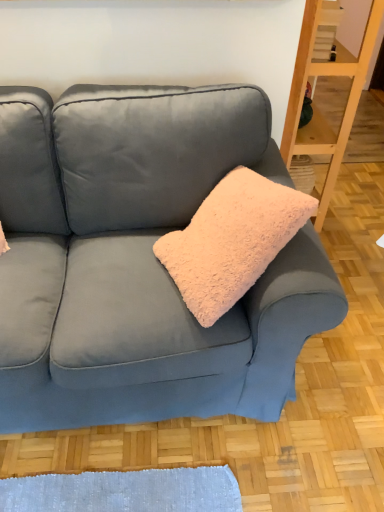
This screenshot has width=384, height=512. What do you see at coordinates (232, 241) in the screenshot?
I see `fuzzy pink pillow at center` at bounding box center [232, 241].

What do you see at coordinates (139, 260) in the screenshot? I see `velvet blue couch at center` at bounding box center [139, 260].

The image size is (384, 512). In order to click on wooden shelf at right in this screenshot , I will do `click(316, 106)`.

Where is `fuzzy pink pillow at center`? fuzzy pink pillow at center is located at coordinates (232, 241).

Is fuzzy pink pillow at center taller or shorter than velvet blue couch at center?

Clearly, fuzzy pink pillow at center is shorter compared to velvet blue couch at center.

Between fuzzy pink pillow at center and velvet blue couch at center, which one appears on the left side from the viewer's perspective?

velvet blue couch at center is more to the left.

Which is farther, (210, 218) or (69, 183)?

The point (69, 183) is farther.

Considering the relative sizes of wooden shelf at right and velvet blue couch at center in the image provided, is wooden shelf at right smaller than velvet blue couch at center?

Yes, wooden shelf at right is smaller than velvet blue couch at center.

Does point (329, 64) come in front of point (245, 366)?

No.

Considering the relative sizes of wooden shelf at right and velvet blue couch at center in the image provided, is wooden shelf at right thinner than velvet blue couch at center?

Indeed, wooden shelf at right has a lesser width compared to velvet blue couch at center.

From the image's perspective, which is above, wooden shelf at right or fuzzy pink pillow at center?

From the image's view, wooden shelf at right is above.

Consider the image. Considering the sizes of wooden shelf at right and fuzzy pink pillow at center in the image, is wooden shelf at right taller or shorter than fuzzy pink pillow at center?

In the image, wooden shelf at right appears to be taller than fuzzy pink pillow at center.

Would you say wooden shelf at right contains fuzzy pink pillow at center?

No, fuzzy pink pillow at center is not a part of wooden shelf at right.

Is wooden shelf at right oriented towards fuzzy pink pillow at center?

No, wooden shelf at right is not turned towards fuzzy pink pillow at center.

What's the angular difference between velvet blue couch at center and fuzzy pink pillow at center's facing directions?

The angle between the facing direction of velvet blue couch at center and the facing direction of fuzzy pink pillow at center is 90 degrees.

Consider the image. From a real-world perspective, is velvet blue couch at center on top of fuzzy pink pillow at center?

Incorrect, from a real-world perspective, velvet blue couch at center is lower than fuzzy pink pillow at center.

Is velvet blue couch at center far away from fuzzy pink pillow at center?

No, velvet blue couch at center is not far away from fuzzy pink pillow at center.

In the scene shown: Would you say velvet blue couch at center is outside fuzzy pink pillow at center?

Yes, velvet blue couch at center is not within fuzzy pink pillow at center.

From the image's perspective, which one is positioned lower, velvet blue couch at center or wooden shelf at right?

velvet blue couch at center, from the image's perspective.

From a real-world perspective, between velvet blue couch at center and wooden shelf at right, who is vertically lower?

velvet blue couch at center.

Who is shorter, velvet blue couch at center or wooden shelf at right?

velvet blue couch at center.

Is velvet blue couch at center oriented towards wooden shelf at right?

No.

Would you say fuzzy pink pillow at center is to the left or to the right of wooden shelf at right in the picture?

In the image, fuzzy pink pillow at center appears on the left side of wooden shelf at right.

Looking at this image, which point is more forward, (202,226) or (377,19)?

The point (202,226) is in front.

Who is bigger, fuzzy pink pillow at center or wooden shelf at right?

With larger size is fuzzy pink pillow at center.

From a real-world perspective, is fuzzy pink pillow at center above or below wooden shelf at right?

fuzzy pink pillow at center is situated higher than wooden shelf at right in the real world.

Locate an element on the screen. studio couch that is under the fuzzy pink pillow at center (from a real-world perspective) is located at coordinates (139, 260).

At what (x,y) coordinates should I click in order to perform the action: click on shelf lying above the velvet blue couch at center (from the image's perspective). Please return your answer as a coordinate pair (x, y). Looking at the image, I should click on (316, 106).

Considering their positions, is velvet blue couch at center positioned closer to wooden shelf at right than fuzzy pink pillow at center?

fuzzy pink pillow at center is closer to wooden shelf at right.

Estimate the real-world distances between objects in this image. Which object is further from velvet blue couch at center, fuzzy pink pillow at center or wooden shelf at right?

wooden shelf at right is further to velvet blue couch at center.

Looking at the image, which one is located further to fuzzy pink pillow at center, velvet blue couch at center or wooden shelf at right?

Based on the image, wooden shelf at right appears to be further to fuzzy pink pillow at center.

Estimate the real-world distances between objects in this image. Which object is closer to velvet blue couch at center, wooden shelf at right or fuzzy pink pillow at center?

fuzzy pink pillow at center.

Looking at the image, which one is located closer to wooden shelf at right, fuzzy pink pillow at center or velvet blue couch at center?

fuzzy pink pillow at center is positioned closer to the anchor wooden shelf at right.

Based on their spatial positions, is wooden shelf at right or velvet blue couch at center closer to fuzzy pink pillow at center?

Based on the image, velvet blue couch at center appears to be nearer to fuzzy pink pillow at center.

Image resolution: width=384 pixels, height=512 pixels. Identify the location of throw pillow located between velvet blue couch at center and wooden shelf at right in the depth direction. (232, 241).